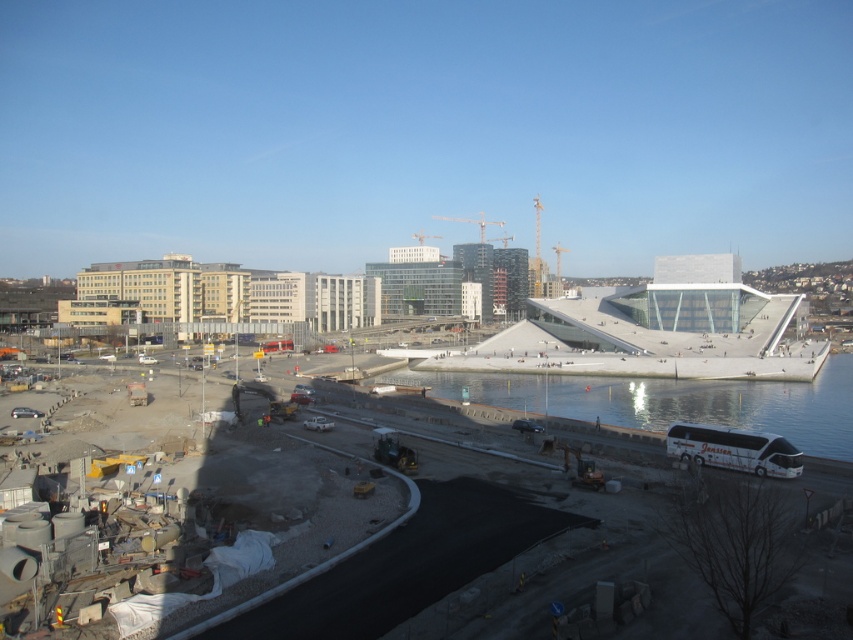
Does clear glass waterway at lower center appear over concrete construction site at lower left?

Correct, clear glass waterway at lower center is located above concrete construction site at lower left.

Measure the distance between point (799, 420) and camera.

A distance of 79.21 meters exists between point (799, 420) and camera.

Image resolution: width=853 pixels, height=640 pixels. Find the location of `clear glass waterway at lower center`. clear glass waterway at lower center is located at coordinates (670, 401).